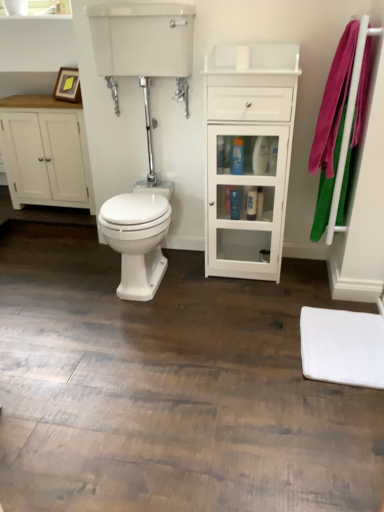
Identify the location of free space above white matte mat at lower right (from a real-world perspective). (341, 341).